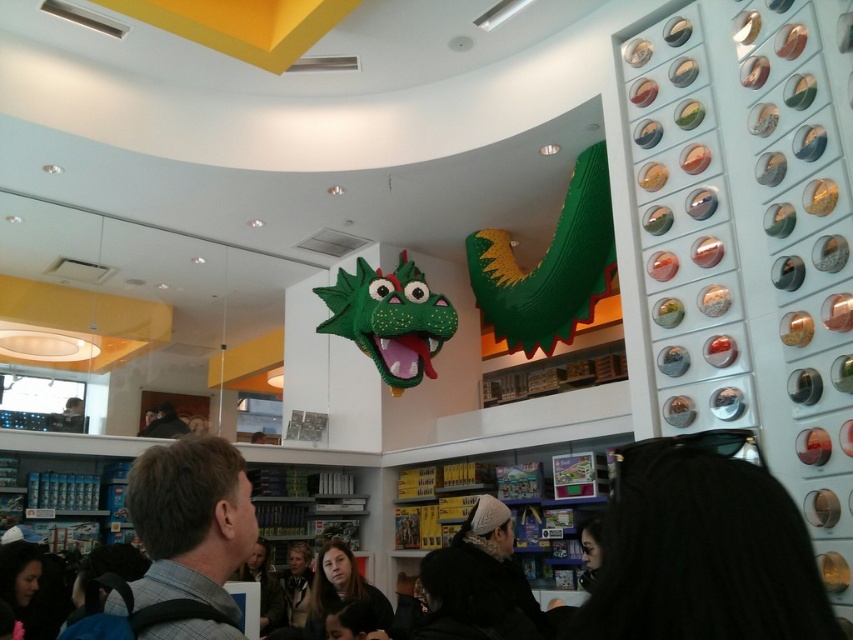
Question: Which point is farther to the camera?

Choices:
 (A) (169, 412)
 (B) (285, 573)

Answer: (A)

Question: Is smooth brown hair at center positioned in front of black fabric at center?

Choices:
 (A) yes
 (B) no

Answer: (A)

Question: Which point appears closest to the camera in this image?

Choices:
 (A) (260, 611)
 (B) (579, 198)
 (C) (407, 282)

Answer: (A)

Question: Which point appears closest to the camera in this image?

Choices:
 (A) (74, 429)
 (B) (180, 426)
 (C) (285, 573)
 (D) (270, 600)

Answer: (D)

Question: Is gray checkered shirt at lower left in front of smooth brown hair at center?

Choices:
 (A) no
 (B) yes

Answer: (B)

Question: In this image, where is black fuzzy hat at center located relative to black fabric at center?

Choices:
 (A) left
 (B) right

Answer: (B)